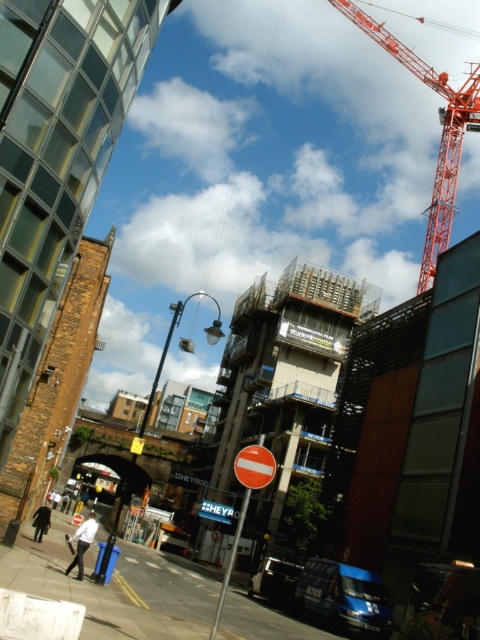
Which is behind, point (252, 476) or point (219, 518)?

The point (219, 518) is more distant.

Between red plastic circle at center and metallic rectangular sign at center, which one has more height?

With more height is red plastic circle at center.

Image resolution: width=480 pixels, height=640 pixels. Describe the element at coordinates (244, 502) in the screenshot. I see `red plastic circle at center` at that location.

You are a GUI agent. You are given a task and a screenshot of the screen. Output one action in this format:
    pyautogui.click(x=<x>, y=<y>)
    Task: Click on the red plastic circle at center
    Image resolution: width=480 pixels, height=640 pixels.
    Given the screenshot: What is the action you would take?
    pyautogui.click(x=244, y=502)

How distant is orange metallic crane at upper right from metallic rectangular sign at center?

orange metallic crane at upper right and metallic rectangular sign at center are 96.87 meters apart from each other.

Is orange metallic crane at upper right closer to the viewer compared to metallic rectangular sign at center?

Yes.

Find the location of a particular element. The height and width of the screenshot is (640, 480). orange metallic crane at upper right is located at coordinates (441, 132).

Is orange metallic crane at upper right further to camera compared to red plastic circle at center?

Yes, orange metallic crane at upper right is behind red plastic circle at center.

Does orange metallic crane at upper right lie in front of red plastic circle at center?

No.

Is point (441, 237) positioned behind point (250, 492)?

That is True.

This screenshot has width=480, height=640. What are the coordinates of `orange metallic crane at upper right` in the screenshot? It's located at (441, 132).